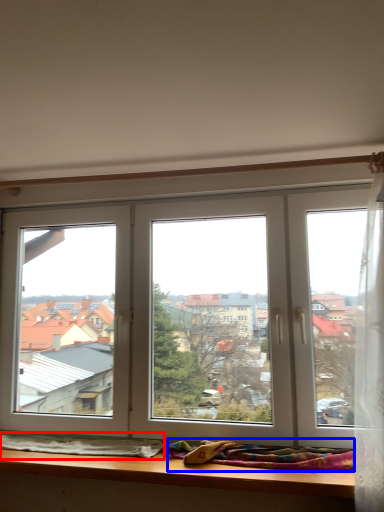
Question: Among these objects, which one is farthest to the camera, blanket (highlighted by a red box) or blanket (highlighted by a blue box)?

Choices:
 (A) blanket
 (B) blanket

Answer: (A)